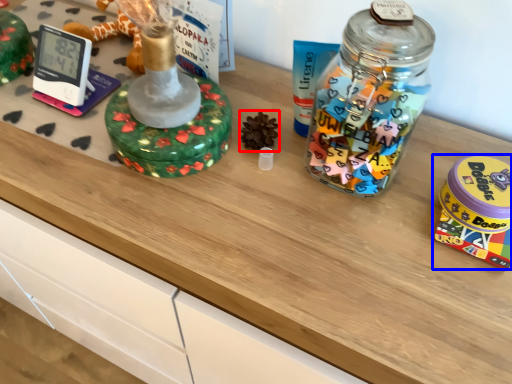
Question: Which object appears closest to the camera in this image, toy (highlighted by a red box) or toy (highlighted by a blue box)?

Choices:
 (A) toy
 (B) toy

Answer: (B)